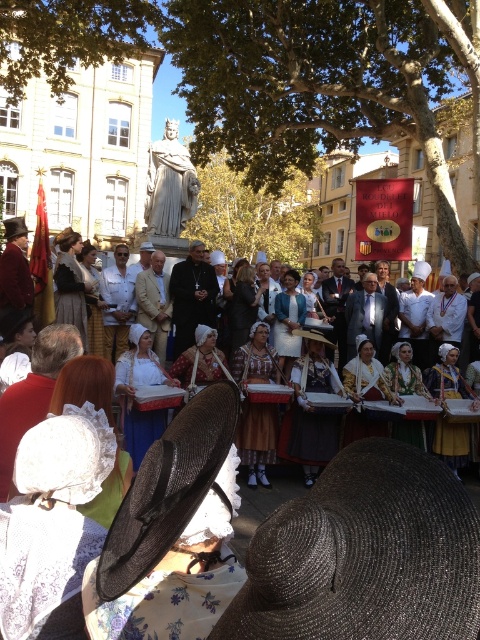
Between silver metallic straw hat at lower center and black straw hat at lower left, which one has more height?

With more height is silver metallic straw hat at lower center.

Does silver metallic straw hat at lower center appear under black straw hat at lower left?

Indeed, silver metallic straw hat at lower center is positioned under black straw hat at lower left.

Between point (309, 540) and point (225, 451), which one is positioned behind?

The point (225, 451) is more distant.

The width and height of the screenshot is (480, 640). I want to click on silver metallic straw hat at lower center, so click(x=364, y=554).